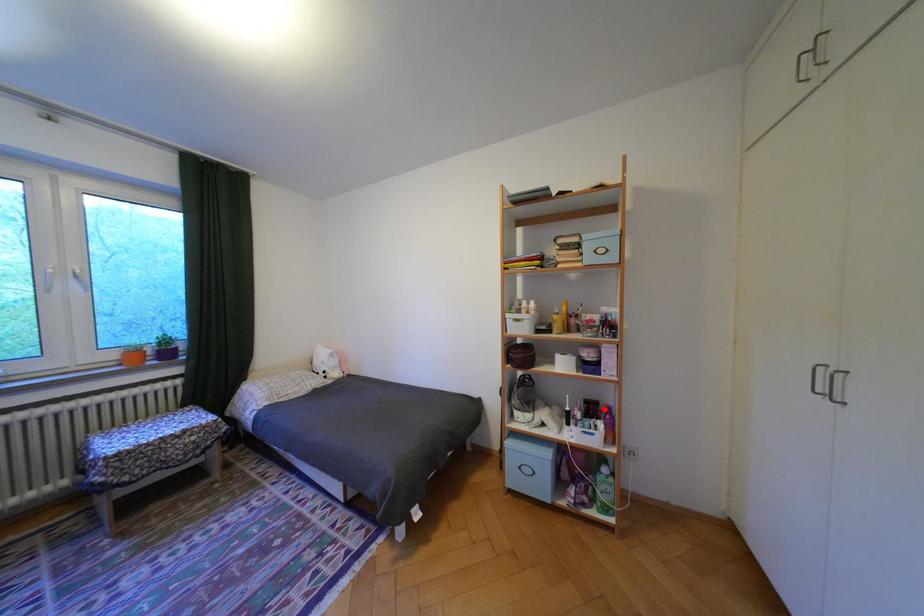
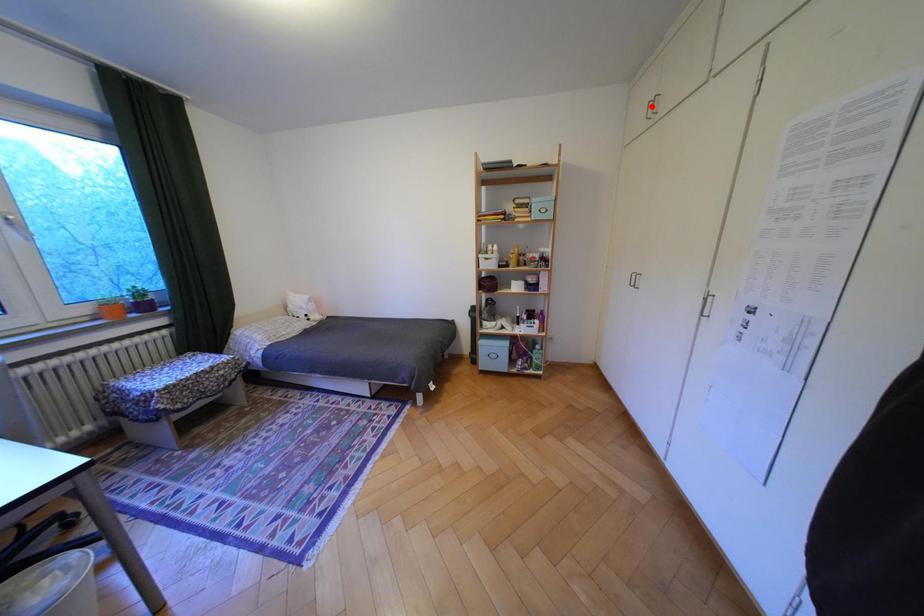
I am providing you with two images of the same scene from different viewpoints. A red point is marked on the first image and another point is marked on the second image. Is the red point in image1 aligned with the point shown in image2?

No